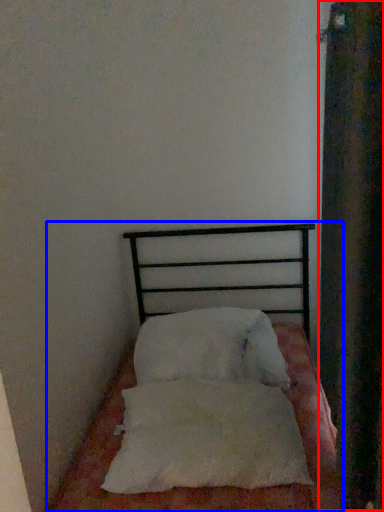
Question: Which of the following is the closest to the observer, curtain (highlighted by a red box) or bed (highlighted by a blue box)?

Choices:
 (A) curtain
 (B) bed

Answer: (A)